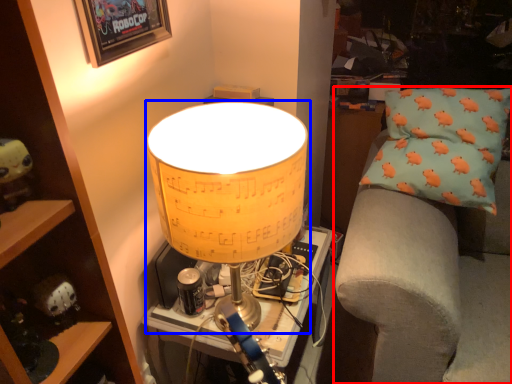
Question: Which point is further to the camera, furniture (highlighted by a red box) or lamp (highlighted by a blue box)?

Choices:
 (A) furniture
 (B) lamp

Answer: (A)